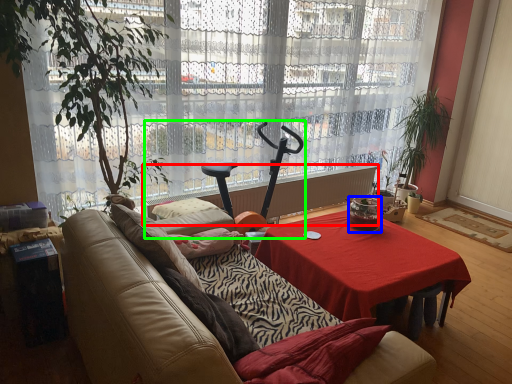
Question: Which object is the farthest from radiator (highlighted by a red box)? Choose among these: coffee cup (highlighted by a blue box) or baby carriage (highlighted by a green box).

Choices:
 (A) coffee cup
 (B) baby carriage

Answer: (A)